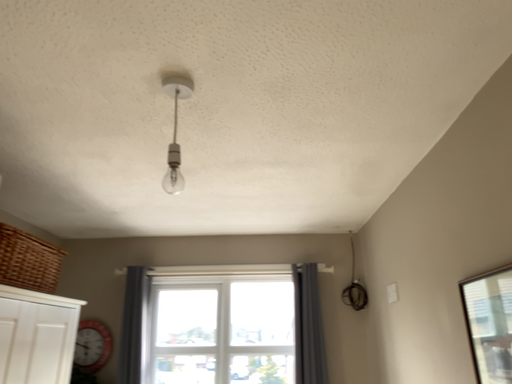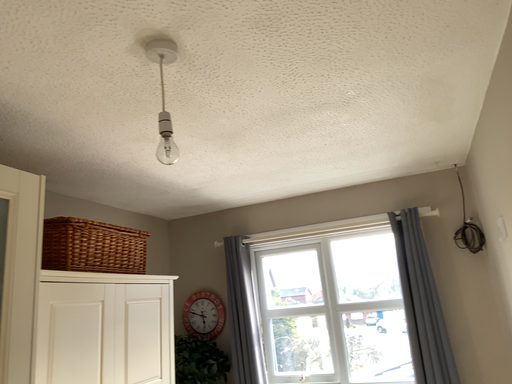
Question: Which way did the camera rotate in the video?

Choices:
 (A) rotated left
 (B) rotated right

Answer: (A)